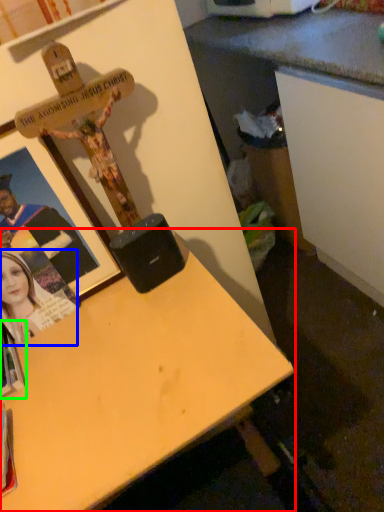
Question: Considering the real-world distances, which object is closest to desk (highlighted by a red box)? person (highlighted by a blue box) or book (highlighted by a green box).

Choices:
 (A) person
 (B) book

Answer: (A)